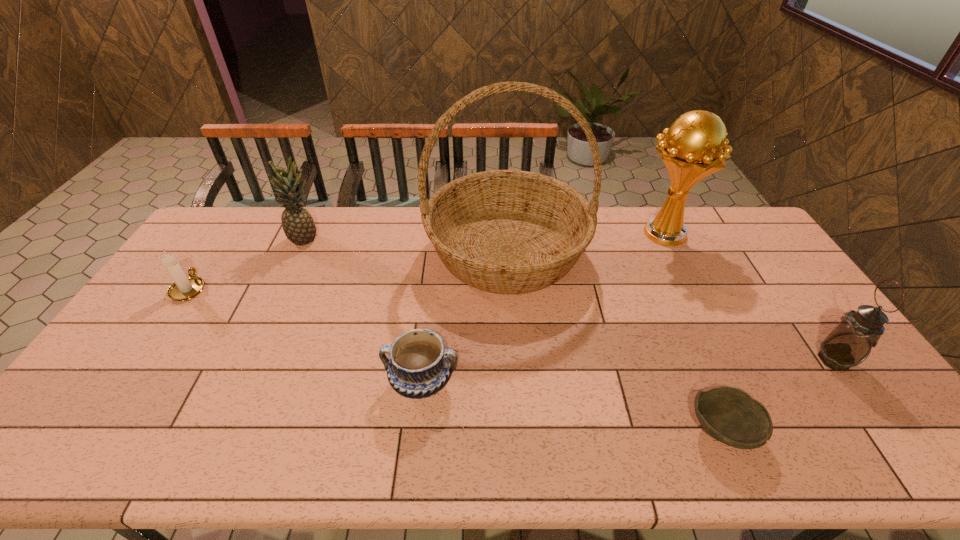
At what (x,y) coordinates should I click in order to perform the action: click on pineapple that is at the far edge. Please return your answer as a coordinate pair (x, y). The height and width of the screenshot is (540, 960). Looking at the image, I should click on (298, 225).

The width and height of the screenshot is (960, 540). In order to click on object that is at the near edge in this screenshot , I will do `click(730, 415)`.

Identify the location of object present at the left edge. (184, 288).

Locate an element on the screen. This screenshot has width=960, height=540. object that is at the right edge is located at coordinates (850, 342).

This screenshot has width=960, height=540. In the image, there is a desktop. In order to click on vacant space at the far edge in this screenshot , I will do `click(344, 242)`.

Where is `free location at the near edge`? free location at the near edge is located at coordinates (152, 431).

You are a GUI agent. You are given a task and a screenshot of the screen. Output one action in this format:
    pyautogui.click(x=<x>, y=<y>)
    Task: Click on the vacant area at the right edge
    The width and height of the screenshot is (960, 540).
    Given the screenshot: What is the action you would take?
    pyautogui.click(x=753, y=285)

This screenshot has height=540, width=960. In order to click on free space at the far right corner of the desktop in this screenshot , I will do coord(759,244).

Identify the location of vacant space that is in between the pottery and the basket. This screenshot has height=540, width=960. (465, 316).

The height and width of the screenshot is (540, 960). Identify the location of vacant space in between the pineapple and the bowl. (515, 334).